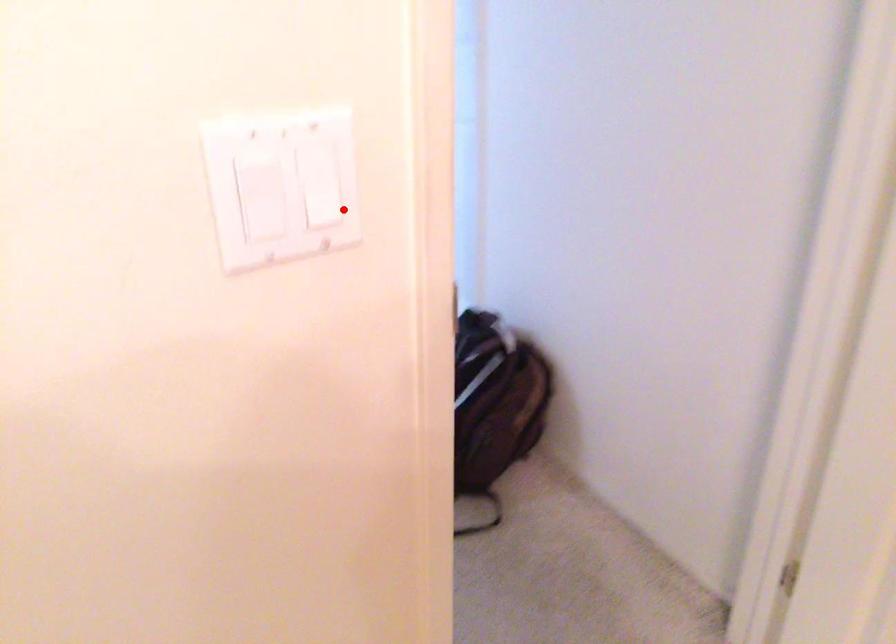
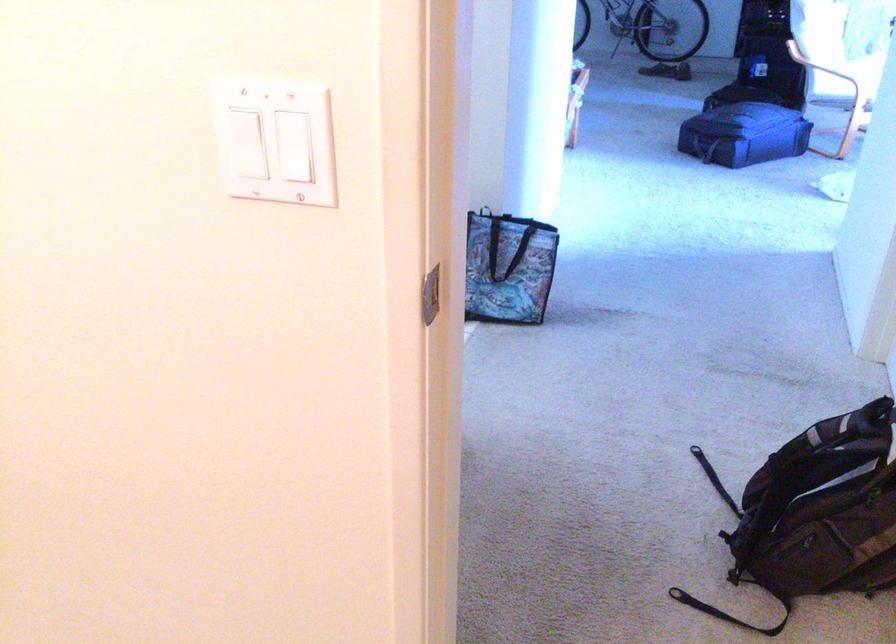
The point at the highlighted location is marked in the first image. Where is the corresponding point in the second image?

(294, 146)